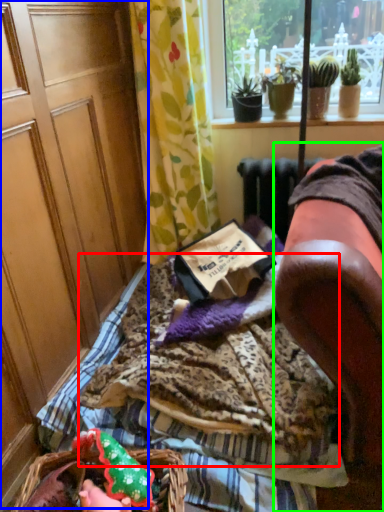
Question: Considering the real-world distances, which object is farthest from blanket (highlighted by a red box)? screen door (highlighted by a blue box) or furniture (highlighted by a green box)?

Choices:
 (A) screen door
 (B) furniture

Answer: (A)